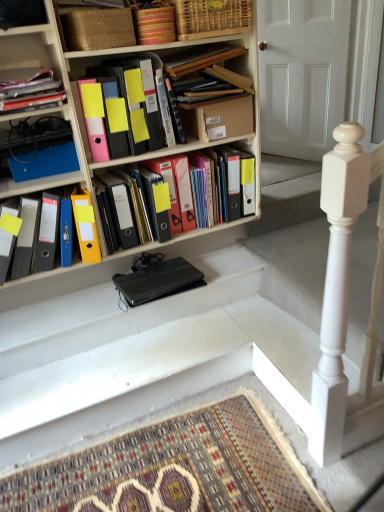
Describe the element at coordinates (158, 168) in the screenshot. I see `yellow matte folder at center, which appears as the 4th book when viewed from the top` at that location.

Identify the location of matte black folder at upper left, the third book from the bottom. (30, 90).

Locate an element on the screen. This screenshot has height=512, width=384. white wooden door at upper center is located at coordinates (302, 74).

Where is `wooden crate at upper center`? wooden crate at upper center is located at coordinates (154, 22).

How different are the orientations of matte black folder at upper left, the third book from the bottom, and white wooden door at upper center in degrees?

The angle between the facing direction of matte black folder at upper left, the third book from the bottom, and the facing direction of white wooden door at upper center is 73.3 degrees.

Is matte black folder at upper left, the third book from the bottom, positioned before white wooden door at upper center?

Yes.

At what (x,y) coordinates should I click in order to perform the action: click on the 4th book to the left of the white wooden door at upper center, counting from the anchor's position. Please return your answer as a coordinate pair (x, y). This screenshot has height=512, width=384. Looking at the image, I should click on (30, 90).

Based on the photo, is matte black folder at upper left, the 3th book viewed from the top, far away from white wooden door at upper center?

That's right, there is a large distance between matte black folder at upper left, the 3th book viewed from the top, and white wooden door at upper center.

Looking at their sizes, would you say woven brown basket at upper center, marked as the second basket in a right-to-left arrangement, is wider or thinner than matte black folder at upper left, the third book from the bottom?

Considering their sizes, woven brown basket at upper center, marked as the second basket in a right-to-left arrangement, looks broader than matte black folder at upper left, the third book from the bottom.

Identify the location of the 1st book to the left of the woven brown basket at upper center, marked as the second basket in a right-to-left arrangement, starting your count from the anchor. Image resolution: width=384 pixels, height=512 pixels. (30, 90).

From a real-world perspective, is woven brown basket at upper center, which ranks as the 1th basket in left-to-right order, on top of matte black folder at upper left, the 3th book viewed from the top?

Yes, from a real-world perspective, woven brown basket at upper center, which ranks as the 1th basket in left-to-right order, is above matte black folder at upper left, the 3th book viewed from the top.

Considering the sizes of patterned carpet at bottom and wooden plank at upper center, the 1th book when ordered from top to bottom, in the image, is patterned carpet at bottom bigger or smaller than wooden plank at upper center, the 1th book when ordered from top to bottom,?

In the image, patterned carpet at bottom appears to be larger than wooden plank at upper center, the 1th book when ordered from top to bottom.

Considering the relative sizes of patterned carpet at bottom and wooden plank at upper center, the 1th book when ordered from top to bottom, in the image provided, is patterned carpet at bottom thinner than wooden plank at upper center, the 1th book when ordered from top to bottom,?

No.

Which object is further away from the camera, patterned carpet at bottom or wooden plank at upper center, positioned as the 5th book in bottom-to-top order?

wooden plank at upper center, positioned as the 5th book in bottom-to-top order, is behind.

Could you measure the distance between patterned carpet at bottom and wooden plank at upper center, positioned as the 5th book in bottom-to-top order?

5.15 feet.

Does black matte laptop at center touch yellow matte folder at center, which appears as the 4th book when viewed from the top?

No, black matte laptop at center is not touching yellow matte folder at center, which appears as the 4th book when viewed from the top.

Is black matte laptop at center facing towards yellow matte folder at center, the 2th book in the bottom-to-top sequence?

No, black matte laptop at center is not turned towards yellow matte folder at center, the 2th book in the bottom-to-top sequence.

From a real-world perspective, who is located higher, black matte laptop at center or yellow matte folder at center, the 2th book in the bottom-to-top sequence?

From a 3D spatial view, yellow matte folder at center, the 2th book in the bottom-to-top sequence, is above.

Considering the sizes of black matte laptop at center and yellow matte folder at center, which appears as the 4th book when viewed from the top, in the image, is black matte laptop at center bigger or smaller than yellow matte folder at center, which appears as the 4th book when viewed from the top,?

black matte laptop at center is smaller than yellow matte folder at center, which appears as the 4th book when viewed from the top.

Is yellow matte folder at center, the 2th book in the bottom-to-top sequence, far from wooden plank at upper center, the 1th book when ordered from top to bottom?

yellow matte folder at center, the 2th book in the bottom-to-top sequence, is near wooden plank at upper center, the 1th book when ordered from top to bottom, not far away.

Would you say yellow matte folder at center, the 2th book in the bottom-to-top sequence, is inside or outside wooden plank at upper center, positioned as the 5th book in bottom-to-top order?

yellow matte folder at center, the 2th book in the bottom-to-top sequence, cannot be found inside wooden plank at upper center, positioned as the 5th book in bottom-to-top order.

Is the depth of yellow matte folder at center, the 2th book in the bottom-to-top sequence, less than that of wooden plank at upper center, the 1th book when ordered from top to bottom?

That is False.

Consider the image. Is yellow matte folder at center, which appears as the 4th book when viewed from the top, taller than wooden plank at upper center, the 1th book when ordered from top to bottom?

Yes.

Is white wooden door at upper center aimed at yellow matte folder at center, the 2th book in the bottom-to-top sequence?

Yes, white wooden door at upper center is oriented towards yellow matte folder at center, the 2th book in the bottom-to-top sequence.

Does white wooden door at upper center come behind yellow matte folder at center, the 2th book in the bottom-to-top sequence?

Yes, the depth of white wooden door at upper center is greater than that of yellow matte folder at center, the 2th book in the bottom-to-top sequence.

Is the surface of white wooden door at upper center in direct contact with yellow matte folder at center, which appears as the 4th book when viewed from the top?

No, white wooden door at upper center is not touching yellow matte folder at center, which appears as the 4th book when viewed from the top.

Between white wooden door at upper center and yellow matte folder at center, which appears as the 4th book when viewed from the top, which one has smaller size?

yellow matte folder at center, which appears as the 4th book when viewed from the top.

Based on the photo, from a real-world perspective, is wooden crate at upper center positioned under cardboard box at upper center based on gravity?

No, from a real-world perspective, wooden crate at upper center is not beneath cardboard box at upper center.

From the image's perspective, is wooden crate at upper center over cardboard box at upper center?

Yes.

Considering the positions of objects wooden crate at upper center and cardboard box at upper center in the image provided, who is more to the right, wooden crate at upper center or cardboard box at upper center?

cardboard box at upper center is more to the right.

At what (x,y) coordinates should I click in order to perform the action: click on crate located above the cardboard box at upper center (from a real-world perspective). Please return your answer as a coordinate pair (x, y). The height and width of the screenshot is (512, 384). Looking at the image, I should click on tap(154, 22).

Locate an element on the screen. door that appears above the matte black folder at upper left, the third book from the bottom (from the image's perspective) is located at coordinates (302, 74).

Locate an element on the screen. The width and height of the screenshot is (384, 512). the 1st book to the left when counting from the woven brown basket at upper center, which ranks as the 1th basket in left-to-right order is located at coordinates (30, 90).

Based on their spatial positions, is matte black folder at upper left, the third book from the bottom, or blue matte folder at left closer to black matte laptop at center?

blue matte folder at left is closer to black matte laptop at center.

Which object lies nearer to the anchor point blue matte folder at left, matte black folder at upper left, the third book from the bottom, or yellow matte folder at center, the 2th book in the bottom-to-top sequence?

matte black folder at upper left, the third book from the bottom.

Looking at the image, which one is located closer to wooden plank at upper center, positioned as the 5th book in bottom-to-top order, matte yellow folder at center, acting as the 4th book starting from the bottom, or blue matte folder at left?

matte yellow folder at center, acting as the 4th book starting from the bottom, is positioned closer to the anchor wooden plank at upper center, positioned as the 5th book in bottom-to-top order.

When comparing their distances from woven brown basket at upper center, which ranks as the 1th basket in left-to-right order, does wooden plank at upper center, positioned as the 5th book in bottom-to-top order, or matte black folder at upper left, the third book from the bottom, seem closer?

Based on the image, matte black folder at upper left, the third book from the bottom, appears to be nearer to woven brown basket at upper center, which ranks as the 1th basket in left-to-right order.

Looking at the image, which one is located closer to black matte laptop at center, matte plastic folders at left, which appears as the 5th book when viewed from the top, or woven bamboo basket at upper center, arranged as the 2th basket when viewed from the left?

matte plastic folders at left, which appears as the 5th book when viewed from the top, lies closer to black matte laptop at center than the other object.

Considering their positions, is wooden crate at upper center positioned further to white wooden door at upper center than cardboard box at upper center?

wooden crate at upper center is positioned further to the anchor white wooden door at upper center.

Consider the image. Looking at the image, which one is located further to matte yellow folder at center, which appears as the second book when viewed from the top, wooden plank at upper center, the 1th book when ordered from top to bottom, or white wooden door at upper center?

white wooden door at upper center is further to matte yellow folder at center, which appears as the second book when viewed from the top.

Considering their positions, is cardboard box at upper center positioned closer to woven bamboo basket at upper center, arranged as the 2th basket when viewed from the left, than woven brown basket at upper center, marked as the second basket in a right-to-left arrangement?

The object closer to woven bamboo basket at upper center, arranged as the 2th basket when viewed from the left, is woven brown basket at upper center, marked as the second basket in a right-to-left arrangement.

The height and width of the screenshot is (512, 384). Find the location of `crate between blue matte folder at left and cardboard box at upper center in the horizontal direction`. crate between blue matte folder at left and cardboard box at upper center in the horizontal direction is located at coordinates (154, 22).

Find the location of a particular element. paperback book between matte black folder at upper left, the third book from the bottom, and patterned carpet at bottom, in the vertical direction is located at coordinates (44, 162).

This screenshot has height=512, width=384. I want to click on crate located between woven brown basket at upper center, which ranks as the 1th basket in left-to-right order, and wooden plank at upper center, positioned as the 5th book in bottom-to-top order, in the left-right direction, so click(154, 22).

You are a GUI agent. You are given a task and a screenshot of the screen. Output one action in this format:
    pyautogui.click(x=<x>, y=<y>)
    Task: Click on the crate situated between matte yellow folder at center, which appears as the second book when viewed from the top, and cardboard box at upper center from left to right
    This screenshot has height=512, width=384.
    Given the screenshot: What is the action you would take?
    pyautogui.click(x=154, y=22)